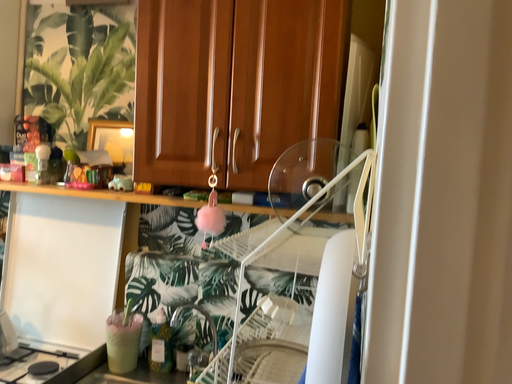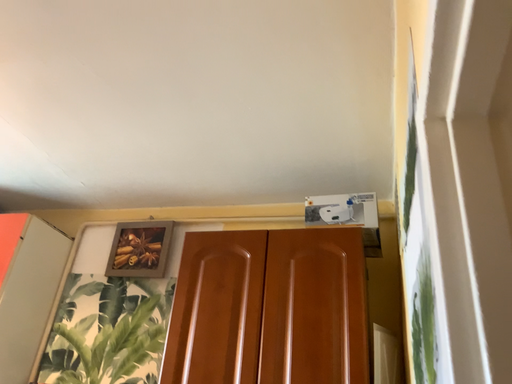
Question: How did the camera likely rotate when shooting the video?

Choices:
 (A) rotated upward
 (B) rotated downward

Answer: (A)